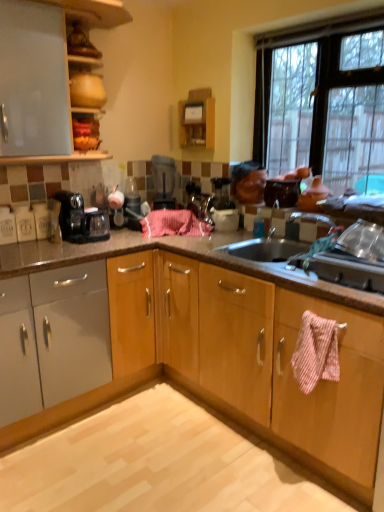
Where is `free space underneath pink striped towel at lower right, the first blanket in the front-to-back sequence (from a real-world perspective)`? free space underneath pink striped towel at lower right, the first blanket in the front-to-back sequence (from a real-world perspective) is located at coordinates (297, 485).